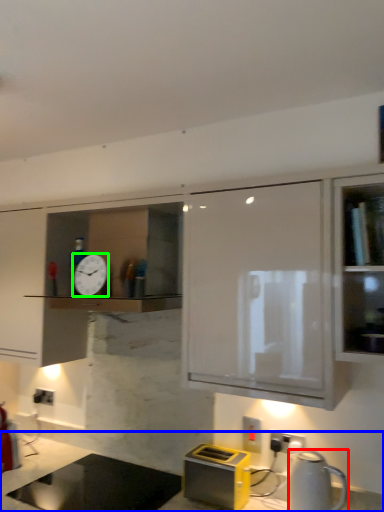
Question: Estimate the real-world distances between objects in this image. Which object is farther from kitchen appliance (highlighted by a red box), countertop (highlighted by a blue box) or clock (highlighted by a green box)?

Choices:
 (A) countertop
 (B) clock

Answer: (A)